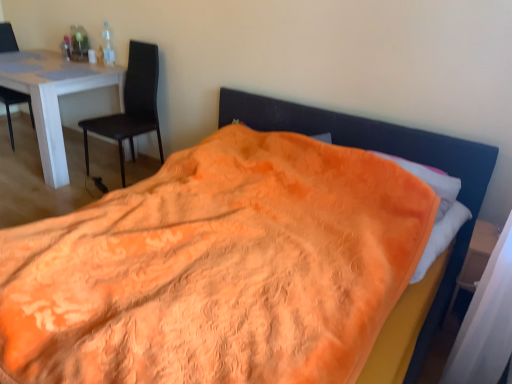
Question: Does matte black chair at left, which is the 1th chair in left-to-right order, have a greater height compared to white glossy table at left?

Choices:
 (A) yes
 (B) no

Answer: (A)

Question: Considering the relative positions of matte black chair at left, which is the 1th chair in left-to-right order, and white glossy table at left in the image provided, is matte black chair at left, which is the 1th chair in left-to-right order, to the right of white glossy table at left from the viewer's perspective?

Choices:
 (A) no
 (B) yes

Answer: (A)

Question: Considering the relative sizes of matte black chair at left, which is the 1th chair in left-to-right order, and white glossy table at left in the image provided, is matte black chair at left, which is the 1th chair in left-to-right order, wider than white glossy table at left?

Choices:
 (A) yes
 (B) no

Answer: (B)

Question: From the image's perspective, is matte black chair at left, placed as the 2th chair when sorted from right to left, below white glossy table at left?

Choices:
 (A) no
 (B) yes

Answer: (A)

Question: Can you confirm if matte black chair at left, which is the 1th chair in left-to-right order, is thinner than white glossy table at left?

Choices:
 (A) yes
 (B) no

Answer: (A)

Question: Considering the relative sizes of matte black chair at left, which is the 1th chair in left-to-right order, and white glossy table at left in the image provided, is matte black chair at left, which is the 1th chair in left-to-right order, bigger than white glossy table at left?

Choices:
 (A) yes
 (B) no

Answer: (B)

Question: Is wooden at right aimed at matte black chair at left, which appears as the second chair when viewed from the left?

Choices:
 (A) no
 (B) yes

Answer: (A)

Question: From the image's perspective, is wooden at right beneath matte black chair at left, which is the first chair from right to left?

Choices:
 (A) no
 (B) yes

Answer: (B)

Question: Is wooden at right positioned with its back to matte black chair at left, which is the first chair from right to left?

Choices:
 (A) no
 (B) yes

Answer: (A)

Question: Is wooden at right taller than matte black chair at left, which appears as the second chair when viewed from the left?

Choices:
 (A) yes
 (B) no

Answer: (B)

Question: From a real-world perspective, is wooden at right on top of matte black chair at left, which is the first chair from right to left?

Choices:
 (A) no
 (B) yes

Answer: (A)

Question: Can you confirm if wooden at right is positioned to the right of matte black chair at left, which appears as the second chair when viewed from the left?

Choices:
 (A) no
 (B) yes

Answer: (B)

Question: Is the surface of matte black chair at left, which is the 1th chair in left-to-right order, in direct contact with wooden at right?

Choices:
 (A) no
 (B) yes

Answer: (A)